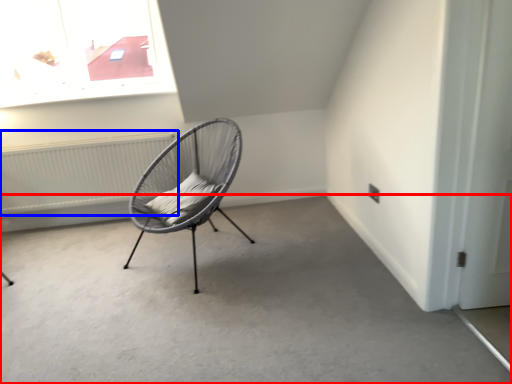
Question: Which object appears closest to the camera in this image, concrete (highlighted by a red box) or radiator (highlighted by a blue box)?

Choices:
 (A) concrete
 (B) radiator

Answer: (A)